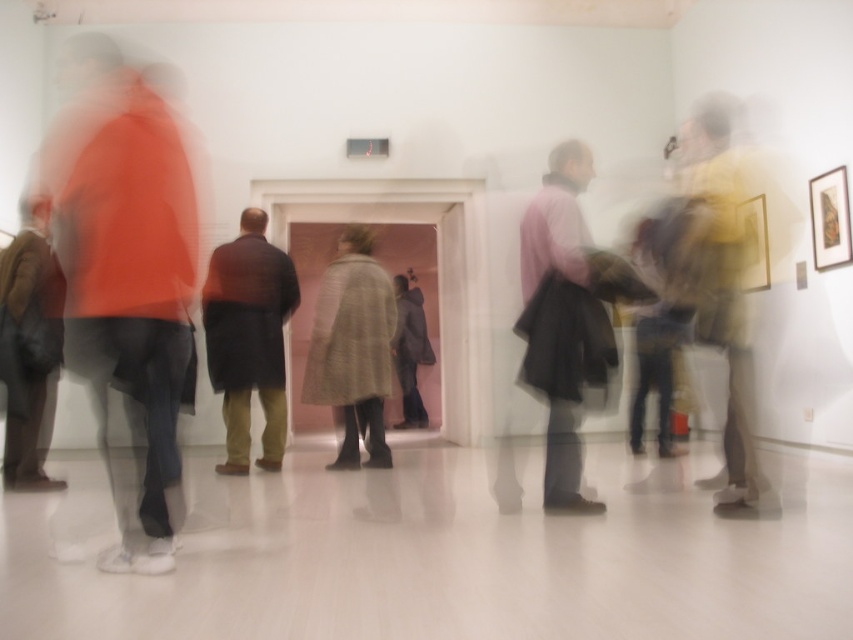
You are standing at the point marked as point (376, 426) in the art gallery. You want to take a photo of the entire gallery using a camera with a 35mm lens. Considering the camera is at your eye level, will the camera be able to capture the entire gallery in one shot?

The distance between the point (376, 426) and the camera is 16.88 feet. However, the question is about capturing the entire gallery with a 35mm lens. A 35mm lens has a field of view of approximately 63 degrees diagonally. To determine if the entire gallery can be captured, we need to know the dimensions of the gallery and the distance from the camera to the farthest walls. Since this information isn not provided in the scene description, we cannot definitively answer whether the entire gallery can be seen

You are an art gallery visitor who wants to take a photo of both the yellow fabric jacket at right and the brown leather jacket at left without moving. Can you capture both in the same frame from your current position?

The yellow fabric jacket at right is to the right of the brown leather jacket at left, so yes, you can capture both in the same frame as long as your camera or phone can capture the entire horizontal span from left to right where both jackets are positioned.